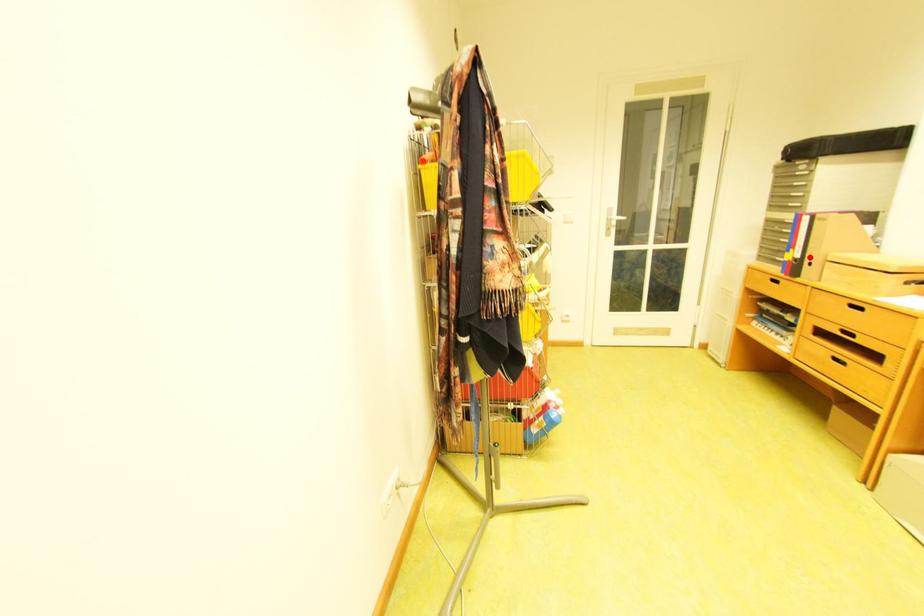
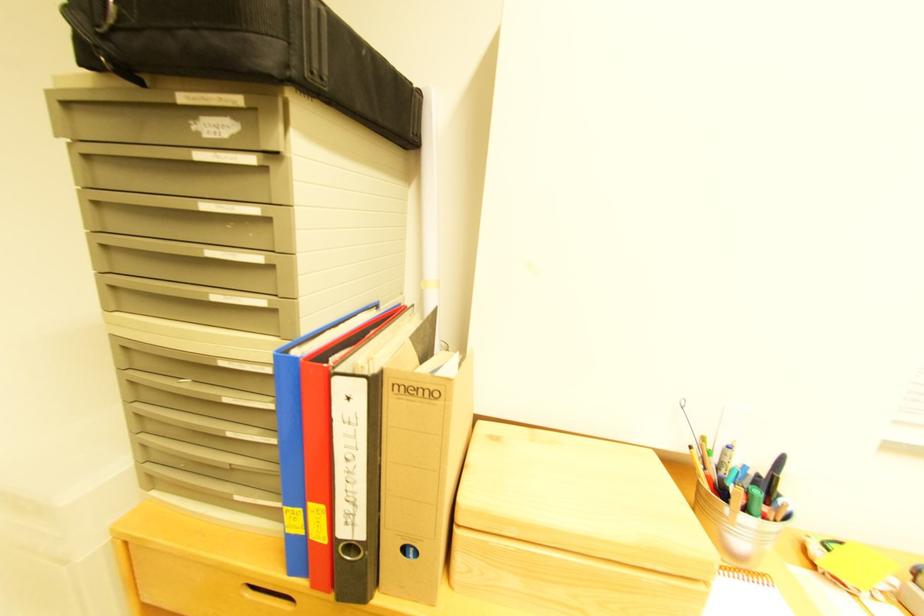
In the second image, find the point that corresponds to the highlighted location in the first image.

(371, 536)